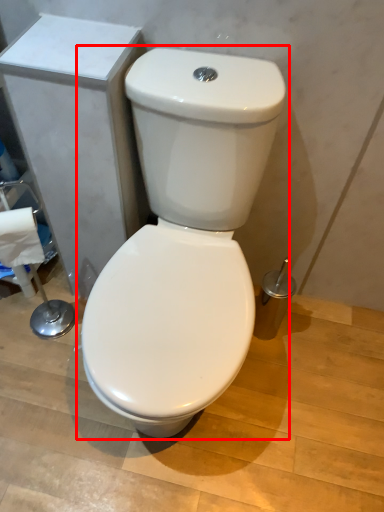
Question: From the image's perspective, considering the relative positions of toilet (annotated by the red box) and toilet paper in the image provided, where is toilet (annotated by the red box) located with respect to the staircase?

Choices:
 (A) below
 (B) above

Answer: (A)